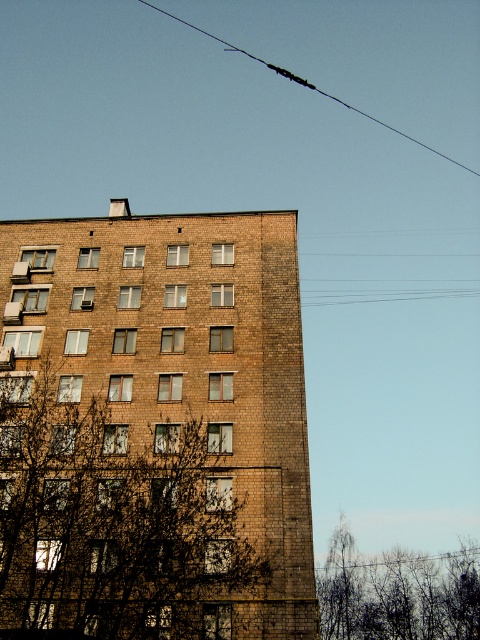
You are a photographer planning to take a picture of the brown brick building at center and the bare branches at lower right. Based on their sizes in the image, which object would appear larger in the final photo?

The brown brick building at center would appear larger in the final photo since it is much taller than the bare branches at lower right.

You are standing in a park and see the brown brick building at center and the bare branches at lower right in the distance. Which object is closer to your current position?

The bare branches at lower right are closer to your current position because the brown brick building at center is to the left of them, indicating it is further away.